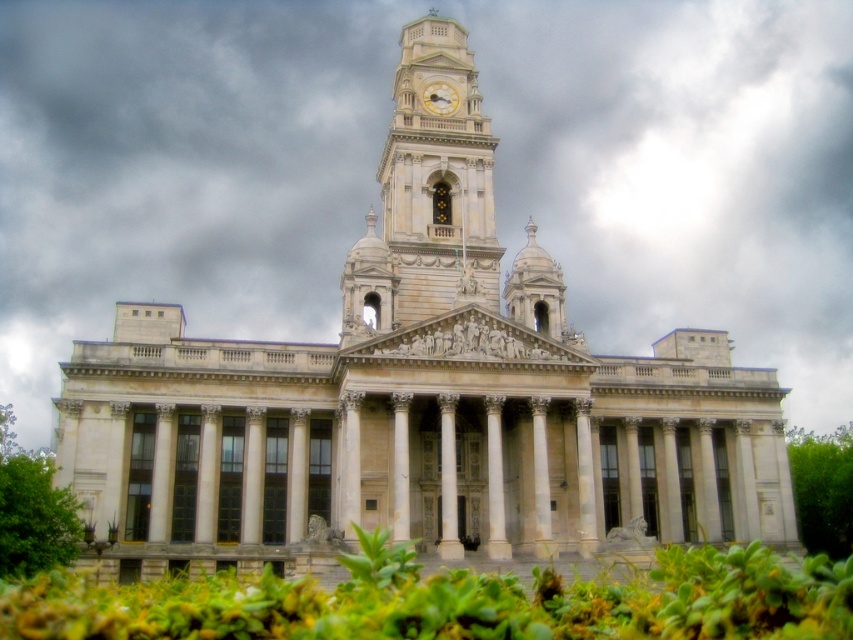
Which is above, green leafy bush at lower right or gold metallic clock at upper center?

Positioned higher is gold metallic clock at upper center.

Who is positioned more to the right, green leafy bush at lower right or gold metallic clock at upper center?

green leafy bush at lower right

At what (x,y) coordinates should I click in order to perform the action: click on green leafy bush at lower right. Please return your answer as a coordinate pair (x, y). Looking at the image, I should click on (822, 488).

Who is shorter, green leafy bush at lower center or green leafy bush at lower right?

green leafy bush at lower right is shorter.

Locate an element on the screen. The width and height of the screenshot is (853, 640). green leafy bush at lower center is located at coordinates (453, 602).

Find the location of `green leafy bush at lower center`. green leafy bush at lower center is located at coordinates (453, 602).

Is white fluffy cloud at upper center thinner than green leafy bush at lower left?

No.

Does white fluffy cloud at upper center have a larger size compared to green leafy bush at lower left?

Correct, white fluffy cloud at upper center is larger in size than green leafy bush at lower left.

At what (x,y) coordinates should I click in order to perform the action: click on white fluffy cloud at upper center. Please return your answer as a coordinate pair (x, y). This screenshot has width=853, height=640. Looking at the image, I should click on (379, 156).